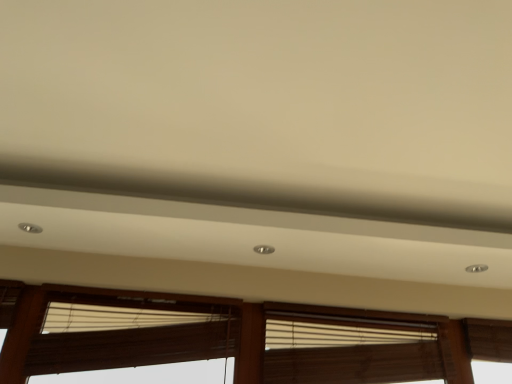
Question: From the image's perspective, does wooden blinds at lower center appear lower than brown fabric window blind at lower center, which is the second window blind in right-to-left order?

Choices:
 (A) no
 (B) yes

Answer: (B)

Question: Is wooden blinds at lower center positioned behind brown fabric window blind at lower center, which is the second window blind in right-to-left order?

Choices:
 (A) no
 (B) yes

Answer: (A)

Question: Is the position of wooden blinds at lower center less distant than that of brown fabric window blind at lower center, which ranks as the first window blind in left-to-right order?

Choices:
 (A) yes
 (B) no

Answer: (A)

Question: Does wooden blinds at lower center have a larger size compared to brown fabric window blind at lower center, which is the second window blind in right-to-left order?

Choices:
 (A) no
 (B) yes

Answer: (B)

Question: Is wooden blinds at lower center turned away from brown fabric window blind at lower center, which ranks as the first window blind in left-to-right order?

Choices:
 (A) yes
 (B) no

Answer: (A)

Question: In the image, is wooden blinds at lower center positioned in front of or behind brown fabric window blind at lower center, which ranks as the first window blind in left-to-right order?

Choices:
 (A) front
 (B) behind

Answer: (A)

Question: Is wooden blinds at lower center taller or shorter than brown fabric window blind at lower center, which ranks as the first window blind in left-to-right order?

Choices:
 (A) short
 (B) tall

Answer: (B)

Question: Is wooden blinds at lower center wider or thinner than brown fabric window blind at lower center, which is the second window blind in right-to-left order?

Choices:
 (A) wide
 (B) thin

Answer: (B)

Question: Is point 275,380 closer or farther from the camera than point 145,306?

Choices:
 (A) farther
 (B) closer

Answer: (B)

Question: Is wooden blinds at center, the second window blind in the left-to-right sequence, in front of or behind wooden blinds at lower center in the image?

Choices:
 (A) front
 (B) behind

Answer: (B)

Question: Is wooden blinds at center, which ranks as the first window blind in right-to-left order, inside or outside of wooden blinds at lower center?

Choices:
 (A) inside
 (B) outside

Answer: (A)

Question: Considering the positions of point (378, 342) and point (481, 332), is point (378, 342) closer or farther from the camera than point (481, 332)?

Choices:
 (A) farther
 (B) closer

Answer: (B)

Question: Considering the positions of wooden blinds at center, which ranks as the first window blind in right-to-left order, and wooden blinds at lower center in the image, is wooden blinds at center, which ranks as the first window blind in right-to-left order, bigger or smaller than wooden blinds at lower center?

Choices:
 (A) big
 (B) small

Answer: (B)

Question: Do you think wooden blinds at lower center is within wooden blinds at center, the second window blind in the left-to-right sequence, or outside of it?

Choices:
 (A) inside
 (B) outside

Answer: (B)

Question: Considering their positions, is wooden blinds at lower center located in front of or behind wooden blinds at center, which ranks as the first window blind in right-to-left order?

Choices:
 (A) behind
 (B) front

Answer: (B)